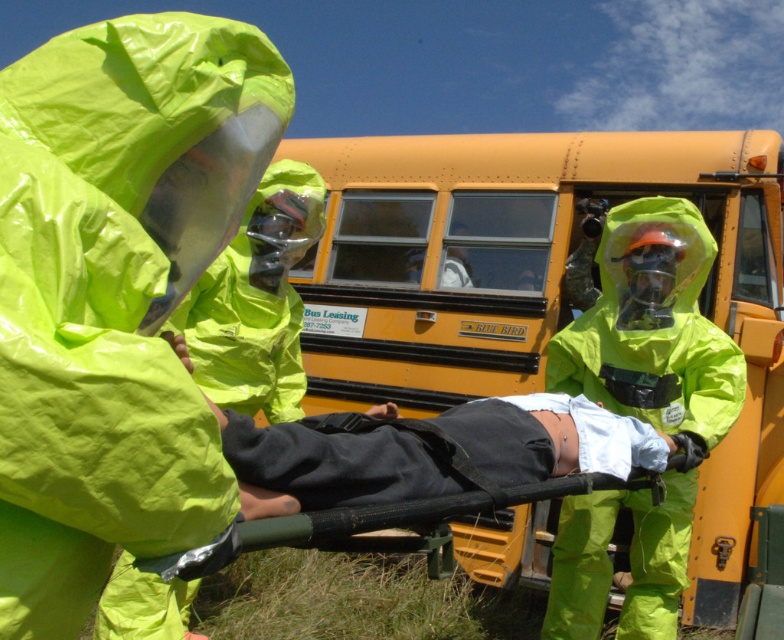
You are a drone operator assigned to monitor the emergency responders. Your task is to ensure that the drone stays within a 1.5 meter radius of the point at coordinates point (x=539, y=289). Can you confirm whether this point is located on the yellow matte school bus at center?

Yes, the point (x=539, y=289) is located on the yellow matte school bus at center, so the drone can stay within the 1.5 meter radius around it.

You are an emergency responder trying to reach the person on the stretcher. Given that you are standing behind the neon yellow hazmat suit at center, which direction should you move to reach the black matte stretcher at center?

Since the neon yellow hazmat suit at center is to the left of the black matte stretcher at center, you should move to the right to reach the stretcher.

You are a drone operator assigned to monitor the emergency responders in the field. The drone has a camera with a 20 inch range. Is the point at coordinates point (158, 269) within the camera range?

The point at coordinates point (158, 269) is 31.17 inches away from the camera. Since the camera has a 20 inch range, the point is outside the camera range.